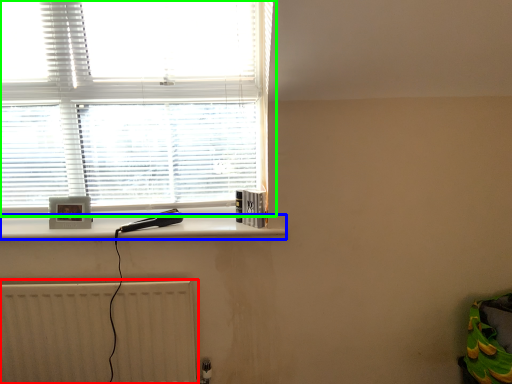
Question: Considering the real-world distances, which object is farthest from radiator (highlighted by a red box)? ledge (highlighted by a blue box) or window (highlighted by a green box)?

Choices:
 (A) ledge
 (B) window

Answer: (B)